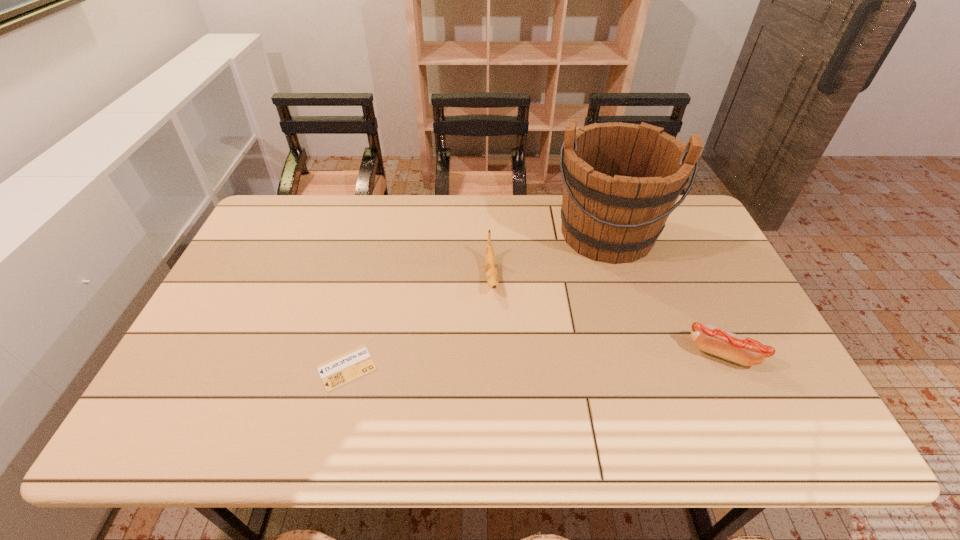
Find the location of a particular element. The image size is (960, 540). vacant space located 0.200m on the peel of the banana from the top is located at coordinates (499, 359).

Locate an element on the screen. The image size is (960, 540). vacant area situated on the side of the tallest object with the handle for carrying is located at coordinates (593, 352).

At what (x,y) coordinates should I click in order to perform the action: click on vacant space located on the side of the tallest object with the handle for carrying. Please return your answer as a coordinate pair (x, y). Looking at the image, I should click on (590, 375).

Identify the location of vacant region located 0.340m on the side of the tallest object with the handle for carrying. This screenshot has height=540, width=960. (592, 361).

The image size is (960, 540). I want to click on object at the far edge, so click(621, 181).

The width and height of the screenshot is (960, 540). In order to click on identity card situated at the near edge in this screenshot , I will do `click(336, 372)`.

Image resolution: width=960 pixels, height=540 pixels. Find the location of `sausage that is at the near edge`. sausage that is at the near edge is located at coordinates (742, 350).

What are the coordinates of `sausage at the right edge` in the screenshot? It's located at (742, 350).

This screenshot has height=540, width=960. I want to click on wine bucket at the right edge, so click(x=621, y=181).

The width and height of the screenshot is (960, 540). Find the location of `object at the far right corner`. object at the far right corner is located at coordinates (621, 181).